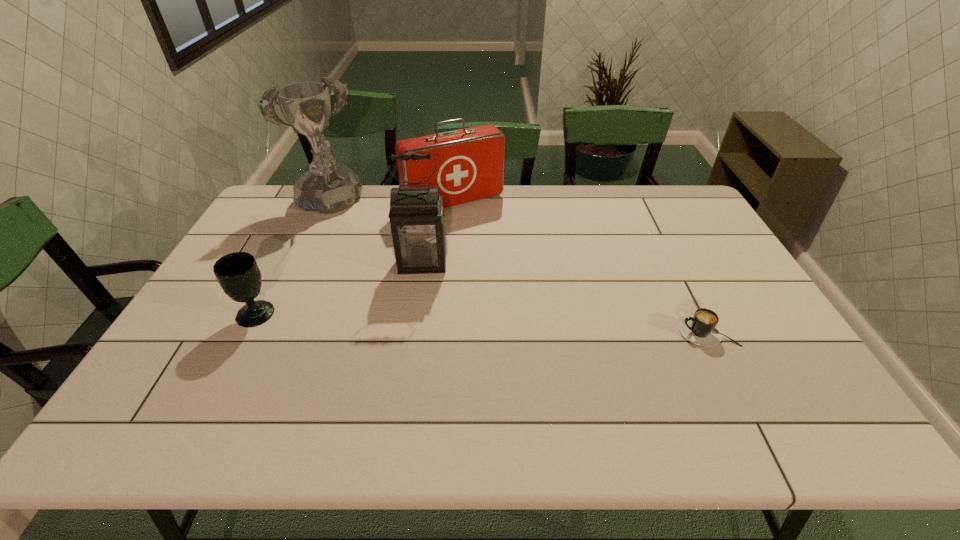
What are the coordinates of `the second shortest object` in the screenshot? It's located at (238, 274).

Locate an element on the screen. The width and height of the screenshot is (960, 540). the rightmost object is located at coordinates (701, 329).

This screenshot has height=540, width=960. I want to click on the shortest object, so click(x=701, y=329).

Where is `the third farthest object`? the third farthest object is located at coordinates (418, 230).

Find the location of a particular element. lantern is located at coordinates (418, 230).

Locate an element on the screen. The height and width of the screenshot is (540, 960). award is located at coordinates (328, 187).

The height and width of the screenshot is (540, 960). What are the coordinates of `the first-aid kit` in the screenshot? It's located at (470, 162).

Image resolution: width=960 pixels, height=540 pixels. Identify the location of vacant region located on the back of the chalice. (286, 255).

This screenshot has width=960, height=540. What are the coordinates of `vacant area situated with the handle on the side of the rightmost object` in the screenshot? It's located at tap(613, 332).

The height and width of the screenshot is (540, 960). Identify the location of vacant space situated 0.390m with the handle on the side of the rightmost object. (528, 332).